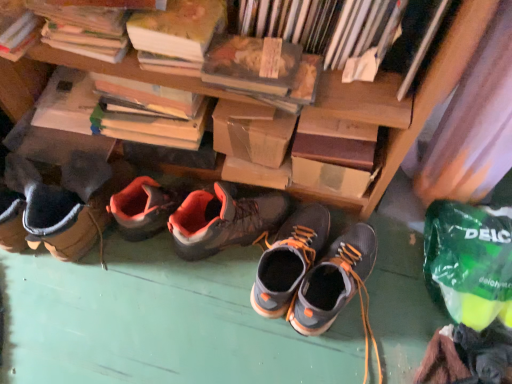
Where is `vacant space to the right of dark gray suede shoes at center, placed as the second footwear when sorted from left to right`? vacant space to the right of dark gray suede shoes at center, placed as the second footwear when sorted from left to right is located at coordinates (390, 278).